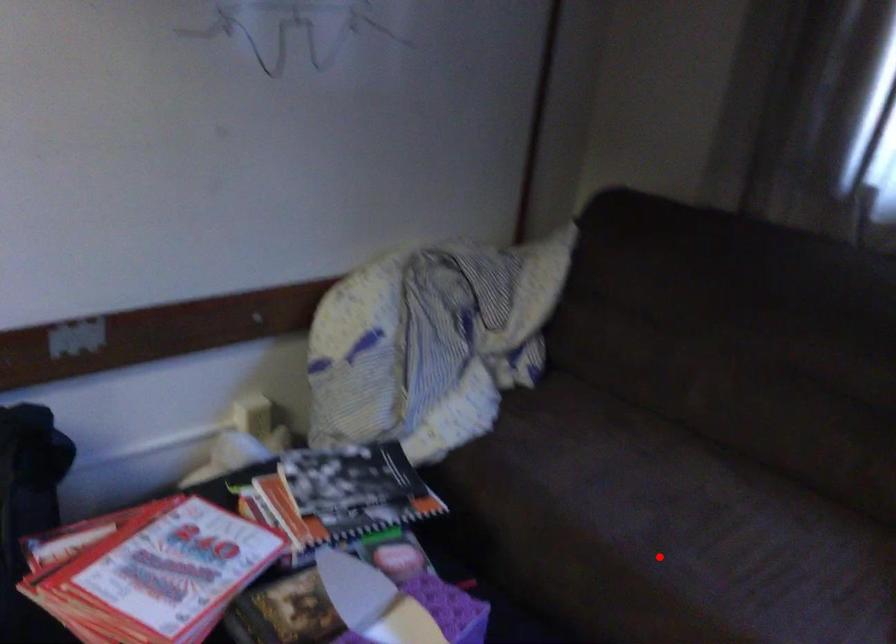
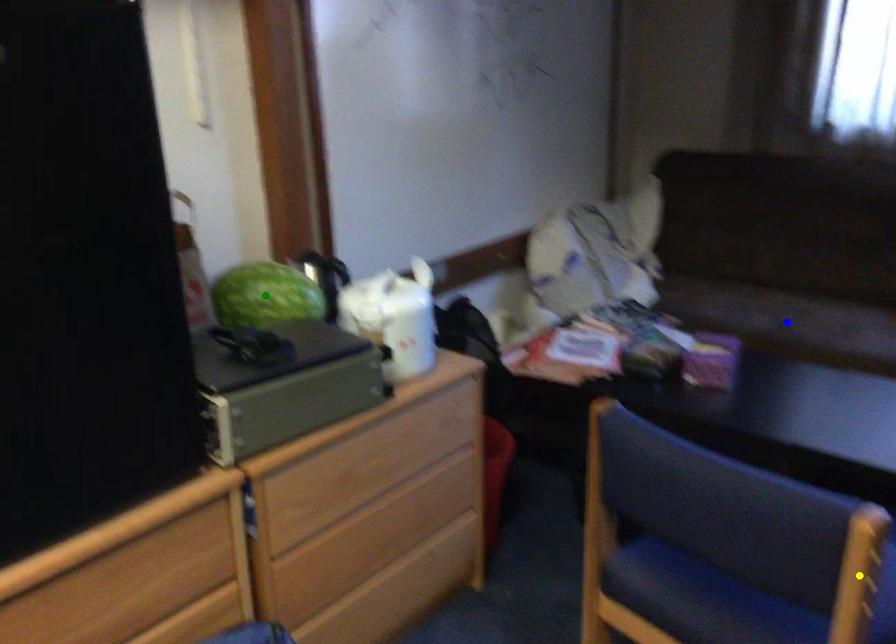
Question: I am providing you with two images of the same scene from different viewpoints. A red point is marked on the first image. You are given multiple points on the second image. Which mark in image 2 goes with the point in image 1?

Choices:
 (A) green point
 (B) yellow point
 (C) blue point

Answer: (C)